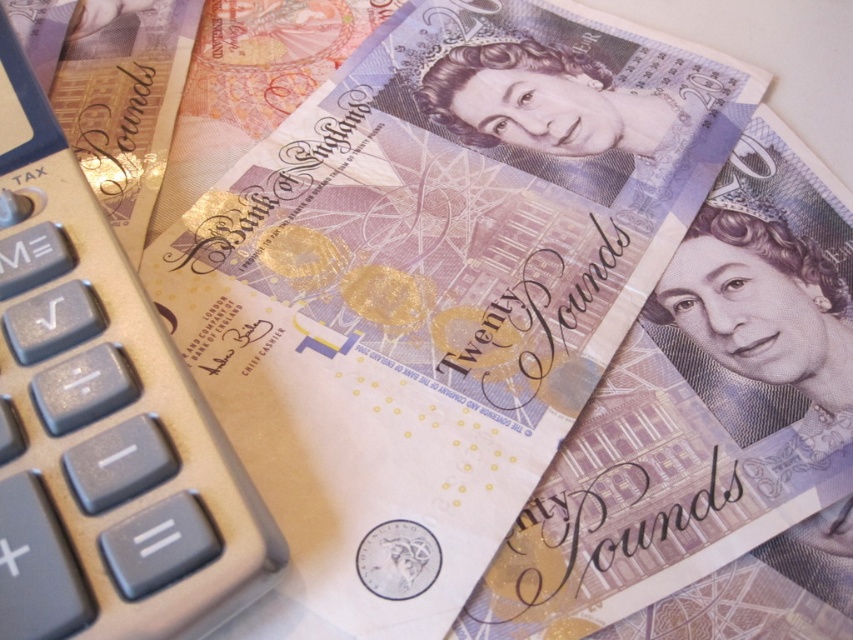
Question: Which of the following is the closest to the observer?

Choices:
 (A) (349, 173)
 (B) (26, 301)

Answer: (B)

Question: Which point is closer to the camera?

Choices:
 (A) (45, 602)
 (B) (599, 93)

Answer: (A)

Question: Does matte purple banknote at center have a lesser width compared to silver metallic calculator at left?

Choices:
 (A) yes
 (B) no

Answer: (B)

Question: Does matte purple banknote at center appear on the left side of silver metallic calculator at left?

Choices:
 (A) yes
 (B) no

Answer: (B)

Question: Does matte purple banknote at center appear on the left side of silver metallic calculator at left?

Choices:
 (A) yes
 (B) no

Answer: (B)